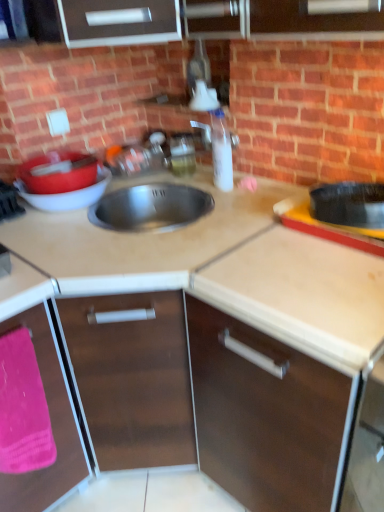
The height and width of the screenshot is (512, 384). Describe the element at coordinates (220, 275) in the screenshot. I see `beige laminate countertop at center, the first countertop in the bottom-to-top sequence` at that location.

The image size is (384, 512). Describe the element at coordinates (182, 153) in the screenshot. I see `translucent plastic soap dispenser at upper center` at that location.

You are a GUI agent. You are given a task and a screenshot of the screen. Output one action in this format:
    pyautogui.click(x=<x>, y=<y>)
    Task: Click on the matte red basin at left
    The width and height of the screenshot is (384, 512).
    Given the screenshot: What is the action you would take?
    pyautogui.click(x=59, y=172)

What do you see at coordinates (221, 151) in the screenshot? The image size is (384, 512). I see `clear plastic bottle at center` at bounding box center [221, 151].

What do you see at coordinates (264, 416) in the screenshot? I see `brown matte cabinet at center, arranged as the first cabinetry when viewed from the right` at bounding box center [264, 416].

Where is `beige laminate countertop at center, the first countertop in the bottom-to-top sequence`? This screenshot has height=512, width=384. beige laminate countertop at center, the first countertop in the bottom-to-top sequence is located at coordinates (220, 275).

Considering the sizes of objects clear plastic bottle at center and matte red basin at left in the image provided, who is wider, clear plastic bottle at center or matte red basin at left?

matte red basin at left.

Does clear plastic bottle at center appear on the left side of matte red basin at left?

No.

Is clear plastic bottle at center touching matte red basin at left?

No, clear plastic bottle at center is not beside matte red basin at left.

Looking at this image, considering the sizes of objects clear plastic bottle at center and matte red basin at left in the image provided, who is smaller, clear plastic bottle at center or matte red basin at left?

With smaller size is clear plastic bottle at center.

Where is `appliance behind the pink fabric at lower left`? This screenshot has width=384, height=512. appliance behind the pink fabric at lower left is located at coordinates (182, 153).

Considering the sizes of objects translucent plastic soap dispenser at upper center and pink fabric at lower left in the image provided, who is bigger, translucent plastic soap dispenser at upper center or pink fabric at lower left?

With larger size is pink fabric at lower left.

From a real-world perspective, is translucent plastic soap dispenser at upper center physically located above or below pink fabric at lower left?

translucent plastic soap dispenser at upper center is situated higher than pink fabric at lower left in the real world.

Which object is positioned more to the right, translucent plastic soap dispenser at upper center or pink fabric at lower left?

translucent plastic soap dispenser at upper center is more to the right.

Can you confirm if matte red basin at left is taller than beige laminate countertop at center, arranged as the second countertop when viewed from the top?

In fact, matte red basin at left may be shorter than beige laminate countertop at center, arranged as the second countertop when viewed from the top.

Is matte red basin at left turned away from beige laminate countertop at center, arranged as the second countertop when viewed from the top?

No, matte red basin at left is not facing the opposite direction of beige laminate countertop at center, arranged as the second countertop when viewed from the top.

Between matte red basin at left and beige laminate countertop at center, arranged as the second countertop when viewed from the top, which one is positioned behind?

matte red basin at left is behind.

Looking at this image, how different are the orientations of matte red basin at left and beige laminate countertop at center, arranged as the second countertop when viewed from the top, in degrees?

There is a 90-degree angle between the facing directions of matte red basin at left and beige laminate countertop at center, arranged as the second countertop when viewed from the top.

From a real-world perspective, which object stands above the other?

matte red basin at left.

Is pink fabric at lower left turned away from matte red basin at left?

No, pink fabric at lower left is not facing the opposite direction of matte red basin at left.

From their relative heights in the image, would you say pink fabric at lower left is taller or shorter than matte red basin at left?

Considering their sizes, pink fabric at lower left has more height than matte red basin at left.

Is beige laminate countertop at center, the first countertop in the bottom-to-top sequence, aimed at pink fabric at lower left?

Yes, beige laminate countertop at center, the first countertop in the bottom-to-top sequence, is oriented towards pink fabric at lower left.

Relative to pink fabric at lower left, is beige laminate countertop at center, arranged as the second countertop when viewed from the top, in front or behind?

beige laminate countertop at center, arranged as the second countertop when viewed from the top, is positioned closer to the viewer than pink fabric at lower left.

Consider the image. Which object is wider, beige laminate countertop at center, the first countertop in the bottom-to-top sequence, or pink fabric at lower left?

beige laminate countertop at center, the first countertop in the bottom-to-top sequence.

Can you confirm if brown matte cabinet at center, arranged as the first cabinetry when viewed from the right, is smaller than matte red basin at left?

Actually, brown matte cabinet at center, arranged as the first cabinetry when viewed from the right, might be larger than matte red basin at left.

Which is correct: brown matte cabinet at center, the 2th cabinetry positioned from the left, is inside matte red basin at left, or outside of it?

brown matte cabinet at center, the 2th cabinetry positioned from the left, is not enclosed by matte red basin at left.

This screenshot has width=384, height=512. I want to click on basin lying behind the brown matte cabinet at center, arranged as the first cabinetry when viewed from the right, so click(x=59, y=172).

Does brown matte cabinet at center, the 2th cabinetry positioned from the left, appear on the right side of matte red basin at left?

Yes, brown matte cabinet at center, the 2th cabinetry positioned from the left, is to the right of matte red basin at left.

Considering the relative sizes of brown matte cabinet at lower left, the 2th cabinetry positioned from the right, and pink fabric at lower left in the image provided, is brown matte cabinet at lower left, the 2th cabinetry positioned from the right, taller than pink fabric at lower left?

Correct, brown matte cabinet at lower left, the 2th cabinetry positioned from the right, is much taller as pink fabric at lower left.

Is brown matte cabinet at lower left, the 1th cabinetry when ordered from left to right, to the left or to the right of pink fabric at lower left in the image?

brown matte cabinet at lower left, the 1th cabinetry when ordered from left to right, is to the left of pink fabric at lower left.

From the image's perspective, does brown matte cabinet at lower left, the 2th cabinetry positioned from the right, appear lower than pink fabric at lower left?

Yes, from the image's perspective, brown matte cabinet at lower left, the 2th cabinetry positioned from the right, is beneath pink fabric at lower left.

Identify the location of basin in front of the clear plastic bottle at center. This screenshot has height=512, width=384. (59, 172).

Identify the location of appliance above the pink fabric at lower left (from a real-world perspective). This screenshot has height=512, width=384. (182, 153).

When comparing their distances from pink fabric at lower left, does clear plastic bottle at center or beige laminate countertop at center, the first countertop in the bottom-to-top sequence, seem closer?

beige laminate countertop at center, the first countertop in the bottom-to-top sequence, lies closer to pink fabric at lower left than the other object.

From the image, which object appears to be farther from satin steel sink at center, which is the 2th countertop from bottom to top, translucent plastic soap dispenser at upper center or pink fabric at lower left?

Based on the image, translucent plastic soap dispenser at upper center appears to be further to satin steel sink at center, which is the 2th countertop from bottom to top.

From the image, which object appears to be farther from matte red basin at left, brown matte cabinet at lower left, the 1th cabinetry when ordered from left to right, or translucent plastic soap dispenser at upper center?

brown matte cabinet at lower left, the 1th cabinetry when ordered from left to right, is positioned further to the anchor matte red basin at left.

Estimate the real-world distances between objects in this image. Which object is further from matte red basin at left, satin steel sink at center, which is the 2th countertop from bottom to top, or translucent plastic soap dispenser at upper center?

translucent plastic soap dispenser at upper center is further to matte red basin at left.

Considering their positions, is pink fabric at lower left positioned further to clear plastic bottle at center than brown matte cabinet at lower left, the 2th cabinetry positioned from the right?

Among the two, pink fabric at lower left is located further to clear plastic bottle at center.

Looking at the image, which one is located further to matte red basin at left, clear plastic bottle at center or beige laminate countertop at center, the first countertop in the bottom-to-top sequence?

Among the two, clear plastic bottle at center is located further to matte red basin at left.

Looking at the image, which one is located further to translucent plastic soap dispenser at upper center, pink fabric at lower left or beige laminate countertop at center, the first countertop in the bottom-to-top sequence?

Based on the image, pink fabric at lower left appears to be further to translucent plastic soap dispenser at upper center.

When comparing their distances from translucent plastic soap dispenser at upper center, does clear plastic bottle at center or satin steel sink at center, the 1th countertop from the top, seem closer?

clear plastic bottle at center.

I want to click on basin between beige laminate countertop at center, the first countertop in the bottom-to-top sequence, and translucent plastic soap dispenser at upper center in the front-back direction, so click(x=59, y=172).

I want to click on countertop between beige laminate countertop at center, arranged as the second countertop when viewed from the top, and matte red basin at left, along the z-axis, so click(x=141, y=241).

The width and height of the screenshot is (384, 512). I want to click on basin that lies between translucent plastic soap dispenser at upper center and brown matte cabinet at lower left, the 1th cabinetry when ordered from left to right, from top to bottom, so click(x=59, y=172).

This screenshot has width=384, height=512. Find the location of `blanket between brown matte cabinet at center, the 2th cabinetry positioned from the left, and translucent plastic soap dispenser at upper center in the front-back direction`. blanket between brown matte cabinet at center, the 2th cabinetry positioned from the left, and translucent plastic soap dispenser at upper center in the front-back direction is located at coordinates point(23,407).